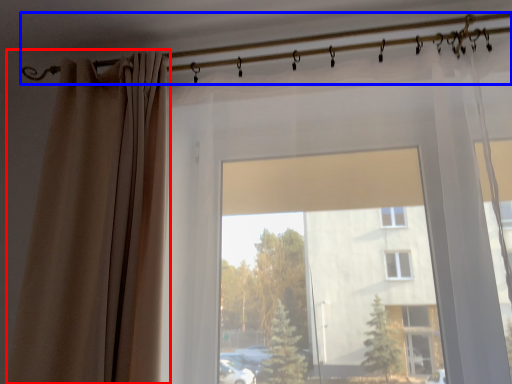
Question: Among these objects, which one is farthest to the camera, curtain (highlighted by a red box) or clothesline (highlighted by a blue box)?

Choices:
 (A) curtain
 (B) clothesline

Answer: (B)